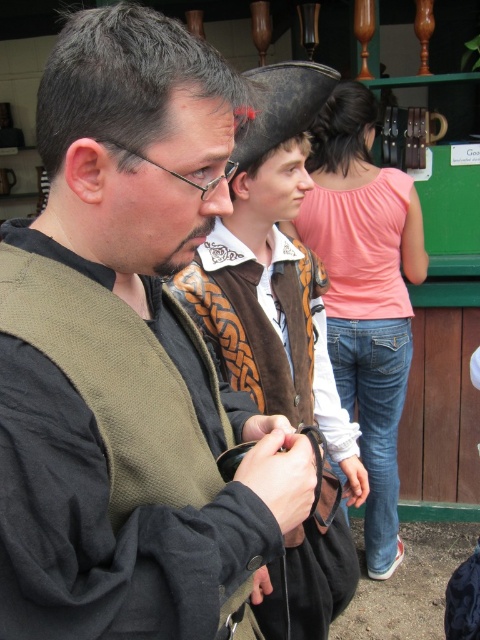
You are an observer at the historical reenactment. You notice the matte brown vest at center and the pink cotton shirt at upper center. Which of these two items is positioned lower in the image?

The matte brown vest at center is positioned below the pink cotton shirt at upper center, so it is lower in the image.

You are an artist trying to paint this historical scene. You need to decide the size of each clothing item based on their positions. Which clothing item, the matte brown vest at center or the pink cotton shirt at upper center, should you draw smaller in your painting?

The matte brown vest at center should be drawn smaller than the pink cotton shirt at upper center because the description states that the matte brown vest at center is smaller than the pink cotton shirt at upper center.